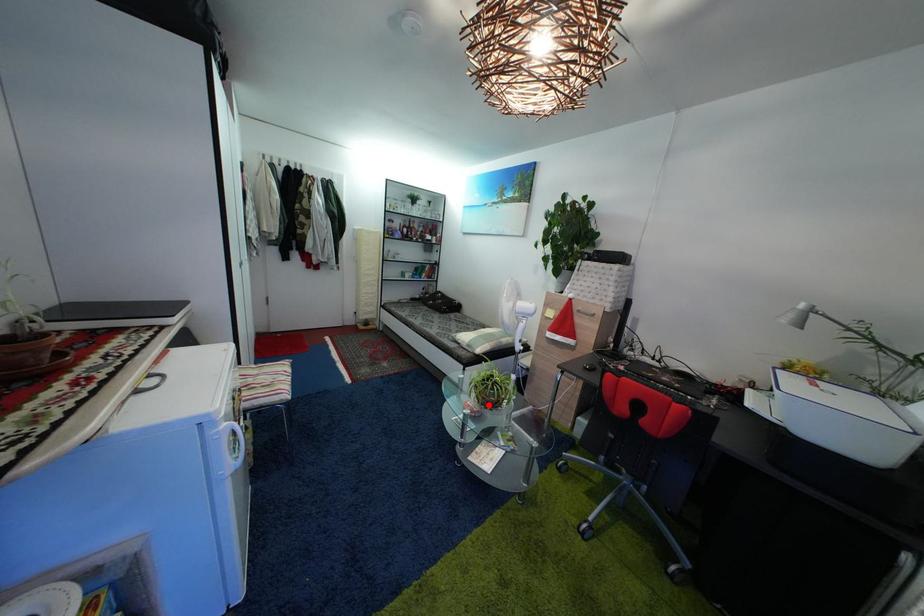
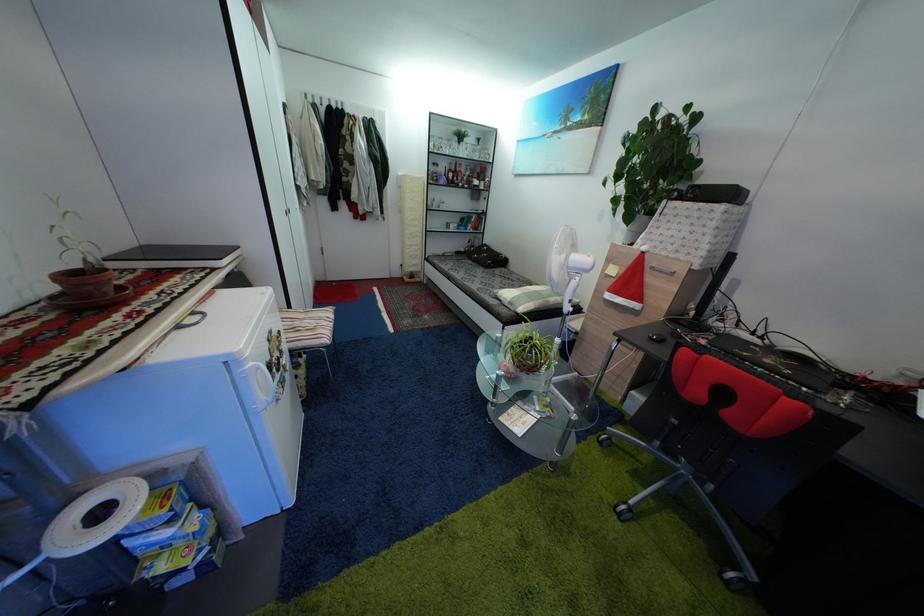
Question: I am providing you with two images of the same scene from different viewpoints. Given a red point in image1, look at the same physical point in image2. Is it:

Choices:
 (A) Closer to the viewpoint
 (B) Farther from the viewpoint

Answer: (A)